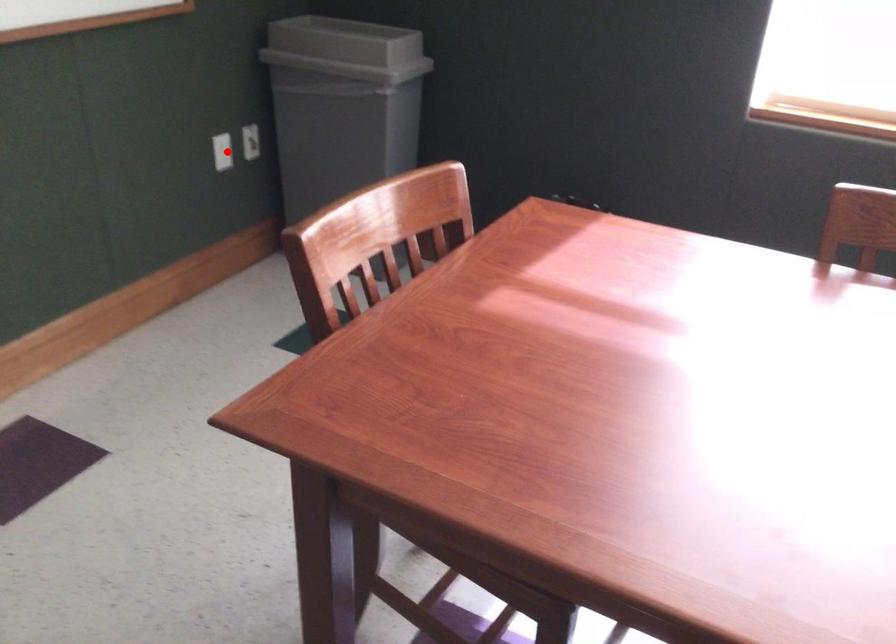
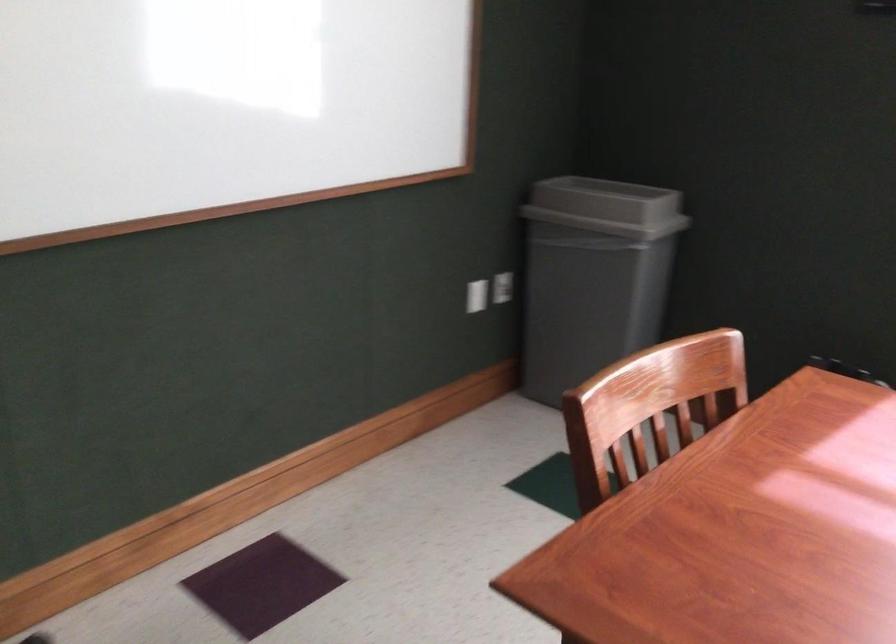
Where in the second image is the point corresponding to the highlighted location from the first image?

(477, 295)